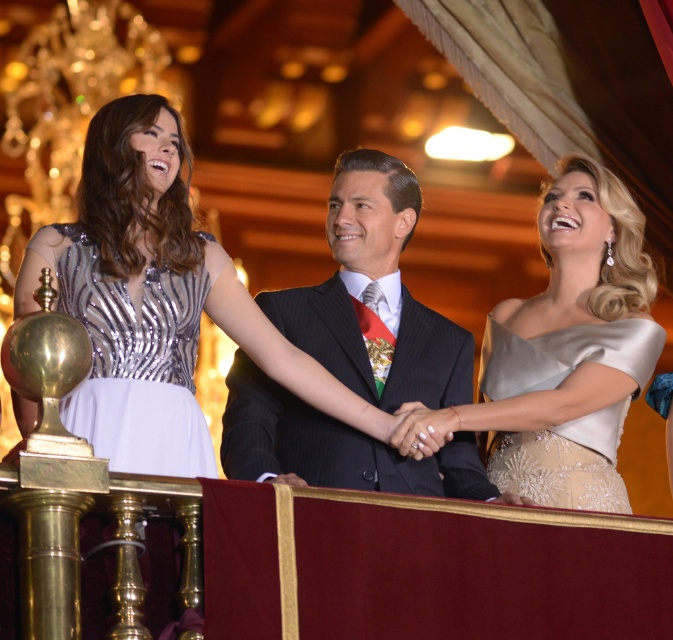
Does point (244, 380) come farther from viewer compared to point (131, 113)?

Yes, it is.

Find the location of `dark pinstripe suit at center`. dark pinstripe suit at center is located at coordinates (374, 296).

You are a GUI agent. You are given a task and a screenshot of the screen. Output one action in this format:
    pyautogui.click(x=<x>, y=<y>)
    Task: Click on the dark pinstripe suit at center
    This screenshot has height=640, width=673.
    Given the screenshot: What is the action you would take?
    pyautogui.click(x=374, y=296)

Find the location of `dark pinstripe suit at center`. dark pinstripe suit at center is located at coordinates (374, 296).

Is shiny silver dress at center to the right of satin beige dress at upper right from the viewer's perspective?

In fact, shiny silver dress at center is to the left of satin beige dress at upper right.

This screenshot has width=673, height=640. Describe the element at coordinates (162, 268) in the screenshot. I see `shiny silver dress at center` at that location.

Who is more distant from viewer, (94, 369) or (548, 214)?

Positioned behind is point (548, 214).

I want to click on shiny silver dress at center, so click(x=162, y=268).

Can you confirm if dark pinstripe suit at center is positioned to the right of satin beige dress at right?

No, dark pinstripe suit at center is not to the right of satin beige dress at right.

Who is lower down, dark pinstripe suit at center or satin beige dress at right?

satin beige dress at right

At what (x,y) coordinates should I click in order to perform the action: click on dark pinstripe suit at center. Please return your answer as a coordinate pair (x, y). The image size is (673, 640). Looking at the image, I should click on (374, 296).